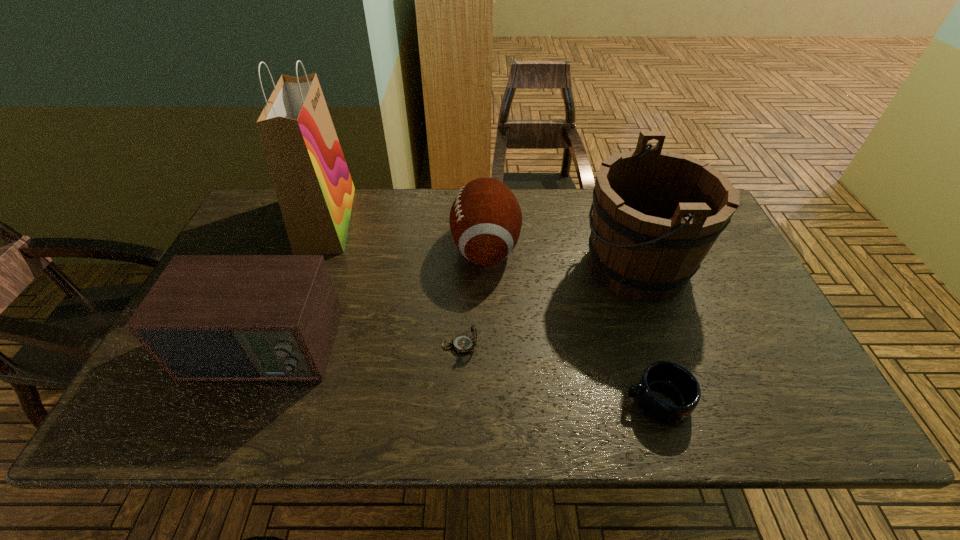
Find the location of `the tallest object`. the tallest object is located at coordinates (315, 191).

Locate an element on the screen. This screenshot has height=540, width=960. wine bucket is located at coordinates (656, 214).

You are a GUI agent. You are given a task and a screenshot of the screen. Output one action in this format:
    pyautogui.click(x=<x>, y=<y>)
    Task: Click on the football
    The image size is (960, 540).
    Given the screenshot: What is the action you would take?
    pyautogui.click(x=485, y=219)

You are a GUI agent. You are given a task and a screenshot of the screen. Output one action in this format:
    pyautogui.click(x=<x>, y=<y>)
    Task: Click on the radio receiver
    This screenshot has height=540, width=960.
    Given the screenshot: What is the action you would take?
    pyautogui.click(x=208, y=317)

What are the coordinates of `compass` in the screenshot? It's located at [463, 343].

Find the location of `mug`. mug is located at coordinates (667, 392).

Where is `vacant space positioned on the right of the shopping bag`? vacant space positioned on the right of the shopping bag is located at coordinates (478, 220).

Image resolution: width=960 pixels, height=540 pixels. I want to click on free region located on the side of the wine bucket with the handle for carrying, so click(x=492, y=266).

At what (x,y) coordinates should I click in order to perform the action: click on vacant space located on the side of the wine bucket with the handle for carrying. Please return your answer as a coordinate pair (x, y). Looking at the image, I should click on (460, 266).

This screenshot has width=960, height=540. Find the location of `free spot located 0.140m on the side of the wine bucket with the handle for carrying`. free spot located 0.140m on the side of the wine bucket with the handle for carrying is located at coordinates (531, 266).